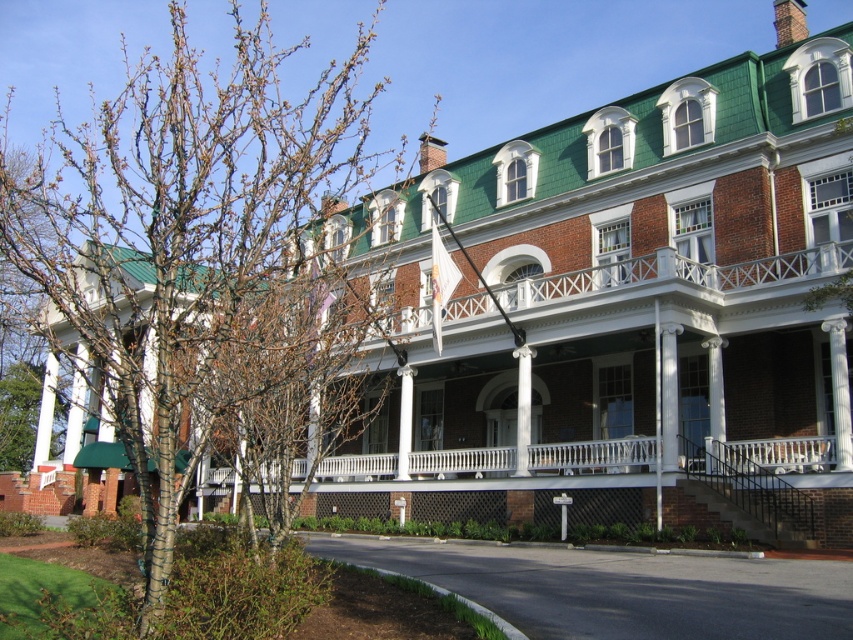
You are standing in front of the building and notice two points marked on the facade. The first point is at coordinate point(573, 468) and the second is at point(39, 365). Which point is closer to you?

Point(573, 468) is closer to the viewer than point(39, 365).

You are an architect analyzing the front view of a historic building. You notice the bare branches at left and the white painted wood porch at center. Which object has a greater width in the image?

The bare branches at left has a greater width than the white painted wood porch at center according to the description.